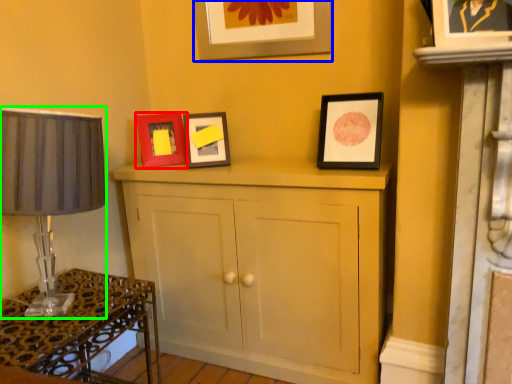
Question: Considering the real-world distances, which object is closest to picture frame (highlighted by a red box)? picture frame (highlighted by a blue box) or table lamp (highlighted by a green box).

Choices:
 (A) picture frame
 (B) table lamp

Answer: (A)